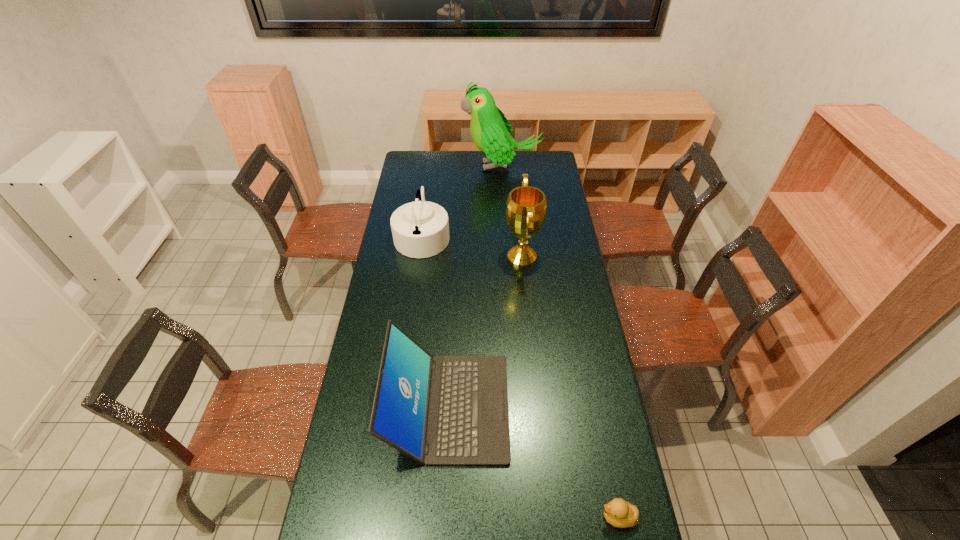
This screenshot has height=540, width=960. Find the location of `vacant point located on the front-facing side of the second tallest object`. vacant point located on the front-facing side of the second tallest object is located at coordinates (420, 256).

At what (x,y) coordinates should I click in order to perform the action: click on vacant space located on the front-facing side of the second tallest object. Please return your answer as a coordinate pair (x, y). Looking at the image, I should click on (489, 256).

The height and width of the screenshot is (540, 960). Find the location of `free point located 0.360m on the front-facing side of the second tallest object`. free point located 0.360m on the front-facing side of the second tallest object is located at coordinates (426, 256).

The width and height of the screenshot is (960, 540). Identify the location of free region located on the spout of the kettle. (514, 235).

Where is `blank space located 0.090m on the screen of the fourth farthest object`? This screenshot has height=540, width=960. blank space located 0.090m on the screen of the fourth farthest object is located at coordinates (534, 407).

The width and height of the screenshot is (960, 540). Identify the location of free space located on the face of the shortest object. (562, 517).

The width and height of the screenshot is (960, 540). I want to click on vacant point located on the face of the shortest object, so click(x=534, y=517).

I want to click on vacant space located 0.340m on the face of the shortest object, so click(x=482, y=517).

Identify the location of object at the far edge. (490, 130).

Image resolution: width=960 pixels, height=540 pixels. I want to click on kettle that is at the left edge, so click(420, 229).